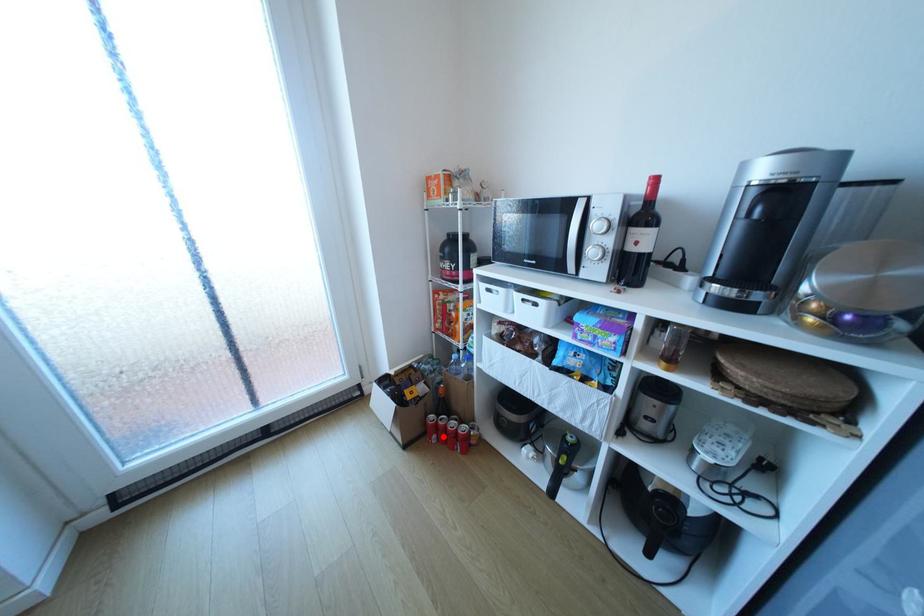
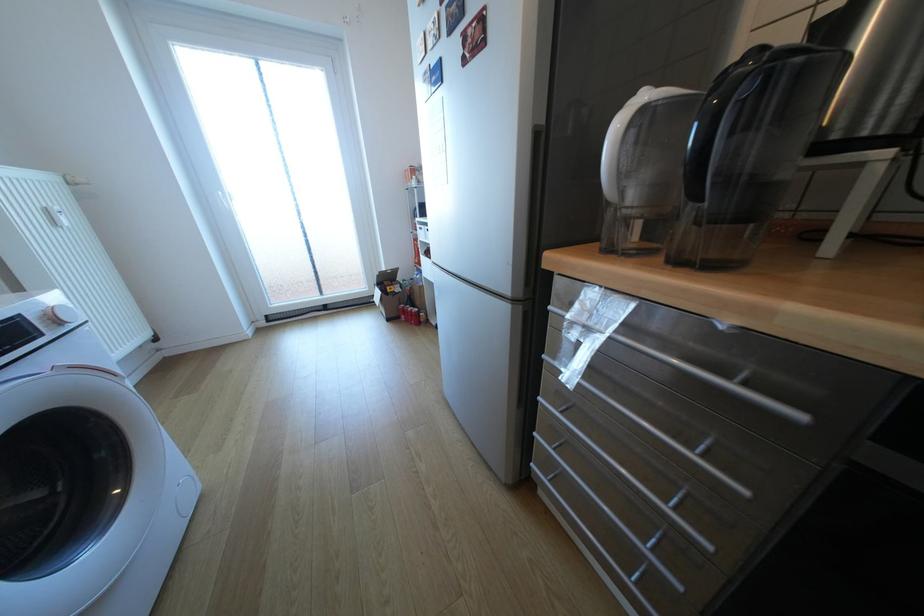
Question: I am providing you with two images of the same scene from different viewpoints. Image1 has a red point marked. In image2, the corresponding 3D location appears at what relative position? Reply with the corresponding letter.

Choices:
 (A) Closer
 (B) Farther

Answer: (A)